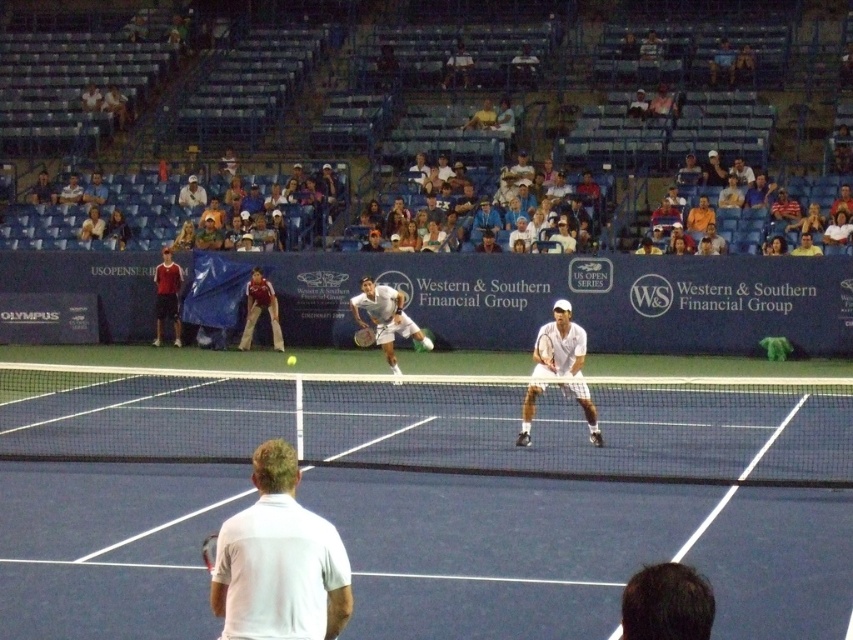
You are a tennis coach analyzing the court setup. Considering the black mesh net at center and the white matte tennis shirt at center, which object has a greater width?

The black mesh net at center has a greater width than the white matte tennis shirt at center.